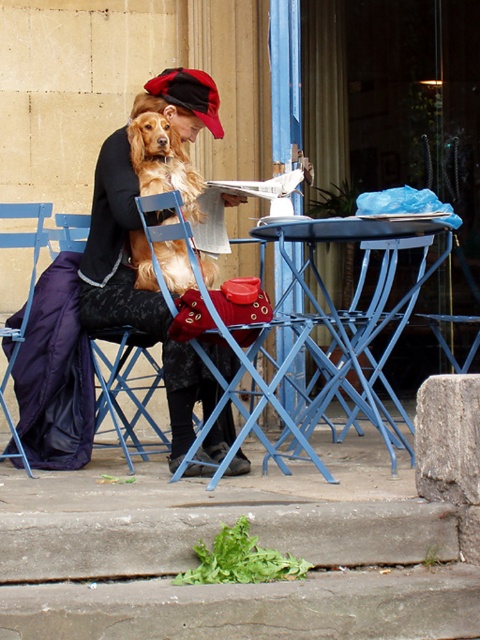
Question: Considering the relative positions of matte black coat at center and golden fur dog at center in the image provided, where is matte black coat at center located with respect to golden fur dog at center?

Choices:
 (A) left
 (B) right

Answer: (A)

Question: Is blue metal table at center further to the viewer compared to blue metal chair at lower center?

Choices:
 (A) no
 (B) yes

Answer: (A)

Question: Observing the image, what is the correct spatial positioning of blue metal chair at lower center in reference to golden fur dog at center?

Choices:
 (A) above
 (B) below

Answer: (B)

Question: Which point is closer to the camera?

Choices:
 (A) (371, 404)
 (B) (224, 438)
 (C) (132, 429)

Answer: (A)

Question: Based on their relative distances, which object is farther from the blue metal table at center?

Choices:
 (A) golden fur dog at center
 (B) blue metal chair at left

Answer: (B)

Question: Which point is farther from the camera taking this photo?

Choices:
 (A) (186, 193)
 (B) (355, 292)
 (C) (112, 358)
 (D) (216, 456)

Answer: (B)